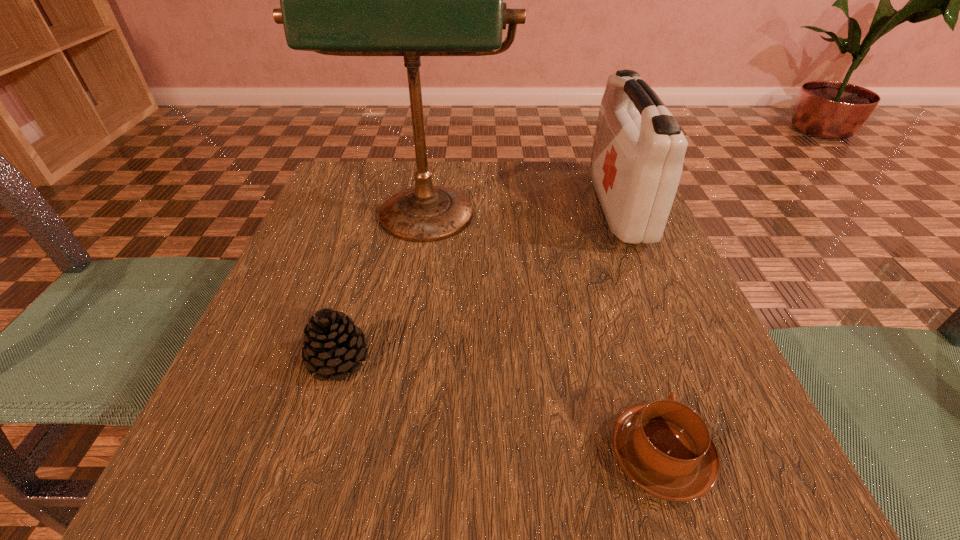
In order to click on table lamp in this screenshot , I will do `click(411, 0)`.

The image size is (960, 540). Identify the location of the first-aid kit. (637, 159).

Image resolution: width=960 pixels, height=540 pixels. I want to click on the third tallest object, so click(x=333, y=345).

At what (x,y) coordinates should I click in order to perform the action: click on pinecone. Please return your answer as a coordinate pair (x, y). Looking at the image, I should click on (333, 345).

Locate an element on the screen. Image resolution: width=960 pixels, height=540 pixels. the nearest object is located at coordinates (664, 447).

Locate an element on the screen. The image size is (960, 540). cappuccino is located at coordinates (664, 447).

Identify the location of vacant space located 0.390m above the green lampshade of the table lamp. (387, 465).

Where is `vacant space situated 0.170m on the front side of the second tallest object`? This screenshot has width=960, height=540. vacant space situated 0.170m on the front side of the second tallest object is located at coordinates (524, 206).

Identify the location of vacant space positioned 0.400m on the front side of the second tallest object. (421, 206).

Image resolution: width=960 pixels, height=540 pixels. What are the coordinates of `free point located on the front side of the second tallest object` in the screenshot? It's located at (538, 206).